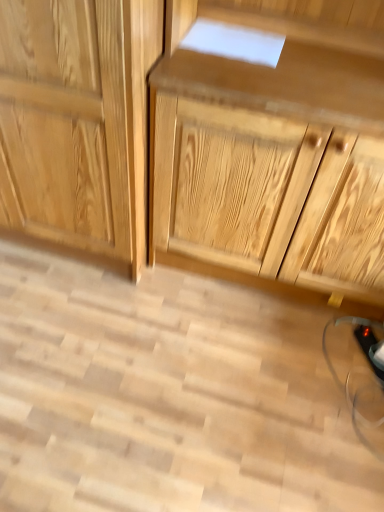
Question: Does natural wood drawer at center have a lesser width compared to natural wood cabinet at center?

Choices:
 (A) yes
 (B) no

Answer: (A)

Question: Is the position of natural wood drawer at center less distant than that of natural wood cabinet at center?

Choices:
 (A) yes
 (B) no

Answer: (A)

Question: From the image's perspective, would you say natural wood drawer at center is positioned over natural wood cabinet at center?

Choices:
 (A) yes
 (B) no

Answer: (B)

Question: Does natural wood drawer at center contain natural wood cabinet at center?

Choices:
 (A) no
 (B) yes

Answer: (A)

Question: Can you confirm if natural wood drawer at center is positioned to the left of natural wood cabinet at center?

Choices:
 (A) no
 (B) yes

Answer: (A)

Question: Can you confirm if natural wood drawer at center is wider than natural wood cabinet at center?

Choices:
 (A) no
 (B) yes

Answer: (A)

Question: From a real-world perspective, is natural wood cabinet at center located beneath natural wood drawer at center?

Choices:
 (A) yes
 (B) no

Answer: (A)

Question: From the image's perspective, does natural wood cabinet at center appear higher than natural wood drawer at center?

Choices:
 (A) yes
 (B) no

Answer: (A)

Question: From a real-world perspective, is natural wood cabinet at center on top of natural wood drawer at center?

Choices:
 (A) yes
 (B) no

Answer: (B)

Question: Is natural wood cabinet at center not close to natural wood drawer at center?

Choices:
 (A) no
 (B) yes

Answer: (A)

Question: Are natural wood cabinet at center and natural wood drawer at center beside each other?

Choices:
 (A) no
 (B) yes

Answer: (A)

Question: Does natural wood cabinet at center appear on the left side of natural wood drawer at center?

Choices:
 (A) no
 (B) yes

Answer: (B)

Question: In the image, is natural wood drawer at center positioned in front of or behind natural wood cabinet at center?

Choices:
 (A) behind
 (B) front

Answer: (B)